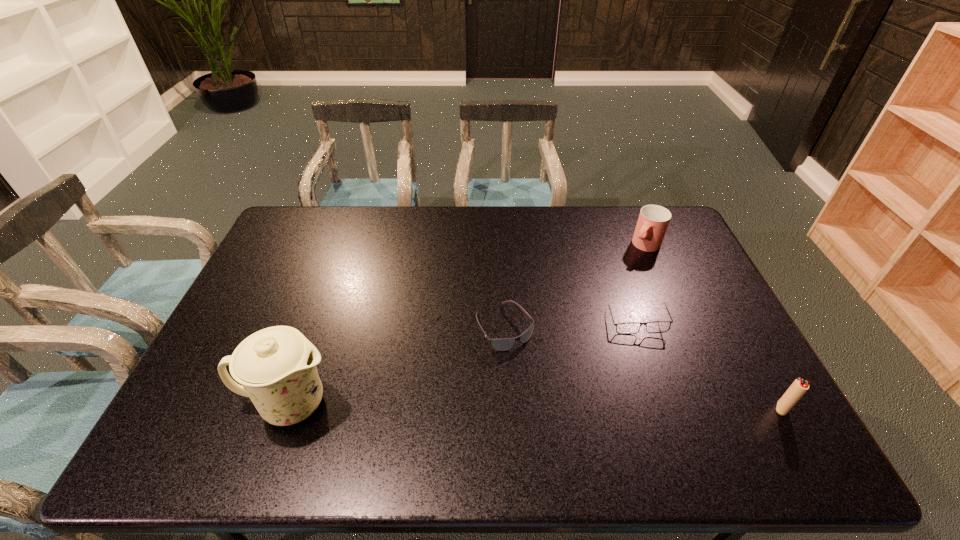
The height and width of the screenshot is (540, 960). What are the coordinates of `object located in the left edge section of the desktop` in the screenshot? It's located at click(x=276, y=366).

The height and width of the screenshot is (540, 960). I want to click on igniter positioned at the right edge, so click(x=798, y=388).

The width and height of the screenshot is (960, 540). In order to click on cup present at the right edge in this screenshot , I will do `click(653, 220)`.

Image resolution: width=960 pixels, height=540 pixels. Identify the location of object positioned at the near left corner. (276, 366).

At what (x,y) coordinates should I click in order to perform the action: click on object located at the far right corner. Please return your answer as a coordinate pair (x, y). Looking at the image, I should click on pyautogui.click(x=653, y=220).

Find the location of a particular element. Image resolution: width=960 pixels, height=540 pixels. object present at the near right corner is located at coordinates (798, 388).

You are a GUI agent. You are given a task and a screenshot of the screen. Output one action in this format:
    pyautogui.click(x=<x>, y=<y>)
    Task: Click on the vacant space at the far edge of the desktop
    Image resolution: width=960 pixels, height=540 pixels.
    Given the screenshot: What is the action you would take?
    pyautogui.click(x=541, y=207)

Identify the location of vacant space at the near edge of the desktop. This screenshot has height=540, width=960. (422, 393).

Image resolution: width=960 pixels, height=540 pixels. I want to click on free space at the left edge, so click(258, 314).

You are a GUI agent. You are given a task and a screenshot of the screen. Output one action in this format:
    pyautogui.click(x=<x>, y=<y>)
    Task: Click on the vacant space at the right edge of the desktop
    
    Given the screenshot: What is the action you would take?
    pyautogui.click(x=714, y=320)